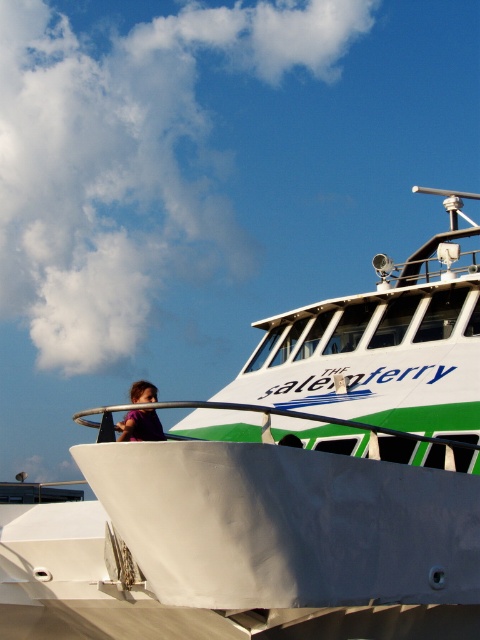
Question: Does white matte ferry at center appear on the right side of purple fabric at upper left?

Choices:
 (A) no
 (B) yes

Answer: (B)

Question: Which point appears farthest from the camera in this image?

Choices:
 (A) (466, 193)
 (B) (144, 422)

Answer: (A)

Question: Does white matte ferry at center have a smaller size compared to purple fabric at upper left?

Choices:
 (A) yes
 (B) no

Answer: (B)

Question: Among these points, which one is farthest from the camera?

Choices:
 (A) (301, 445)
 (B) (147, 392)

Answer: (A)

Question: Does white matte ferry at center have a greater width compared to purple fabric at upper left?

Choices:
 (A) no
 (B) yes

Answer: (B)